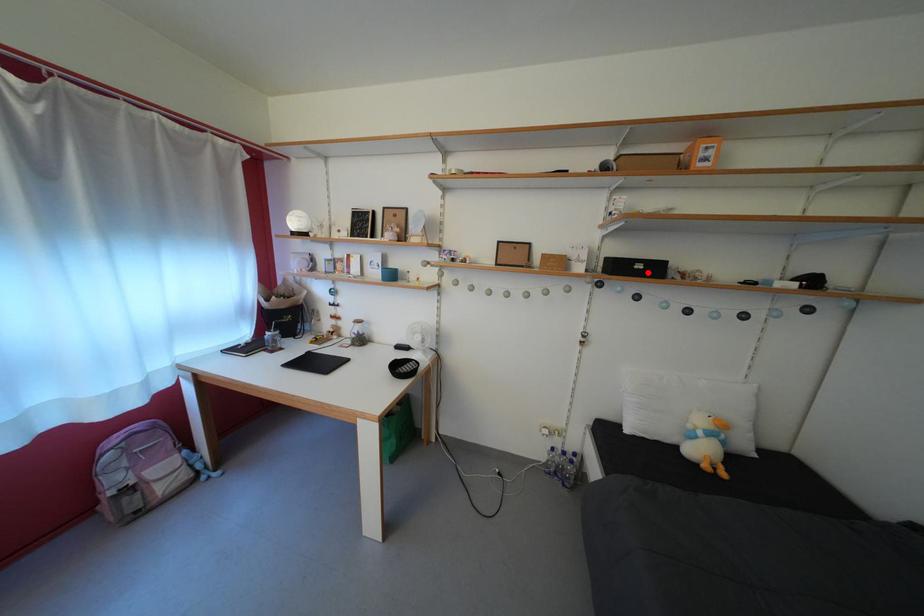
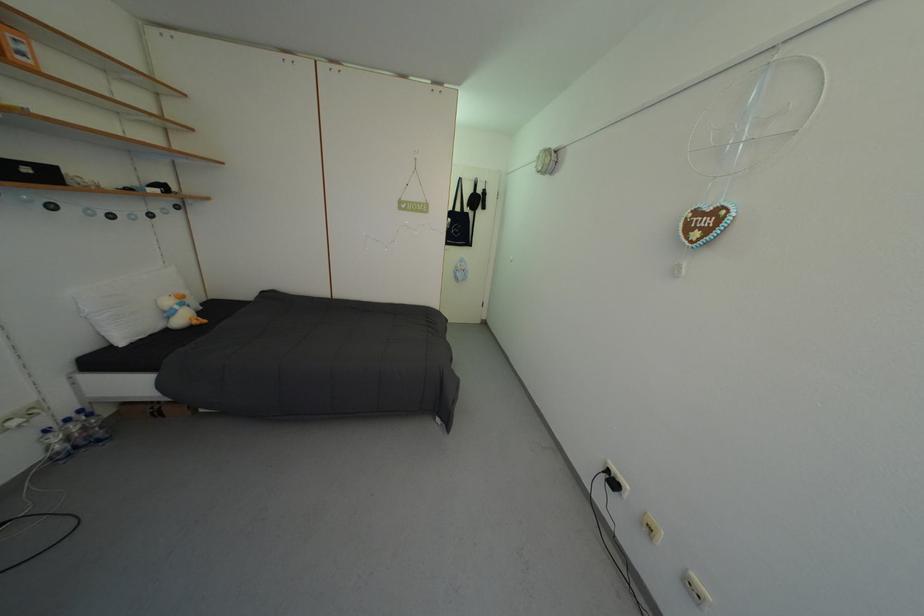
Question: I am providing you with two images of the same scene from different viewpoints. Given a red point in image1, look at the same physical point in image2. Is it:

Choices:
 (A) Closer to the viewpoint
 (B) Farther from the viewpoint

Answer: (B)